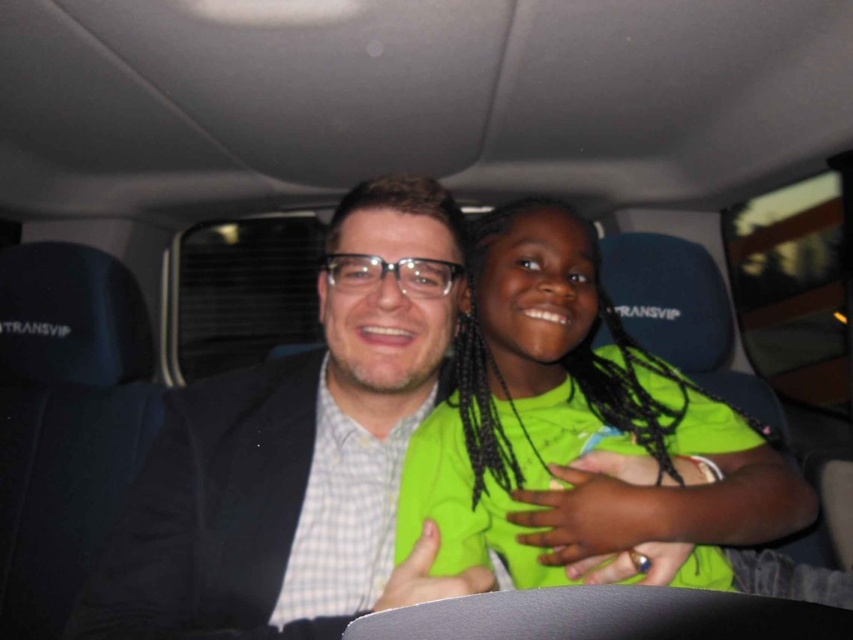
Question: Which point is farther from the camera taking this photo?

Choices:
 (A) (593, 502)
 (B) (357, 477)

Answer: (B)

Question: Is matte black suit at center bigger than neon green shirt at center?

Choices:
 (A) no
 (B) yes

Answer: (A)

Question: Which point appears closest to the camera in this image?

Choices:
 (A) (202, 467)
 (B) (676, 385)

Answer: (A)

Question: Is matte black suit at center above neon green shirt at center?

Choices:
 (A) no
 (B) yes

Answer: (A)

Question: Does matte black suit at center have a lesser width compared to neon green shirt at center?

Choices:
 (A) yes
 (B) no

Answer: (A)